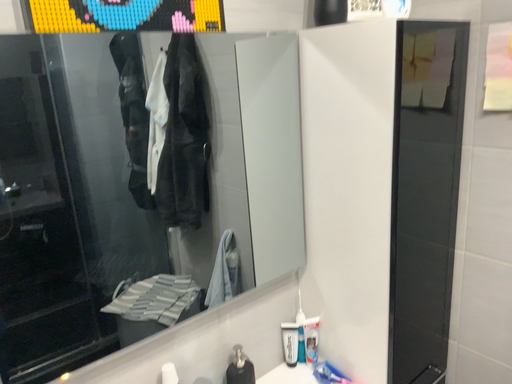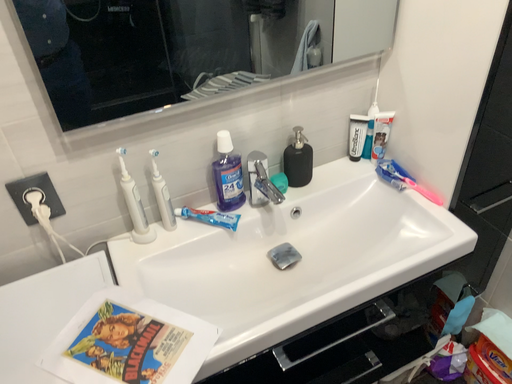
Question: Which way did the camera rotate in the video?

Choices:
 (A) rotated left
 (B) rotated right

Answer: (A)